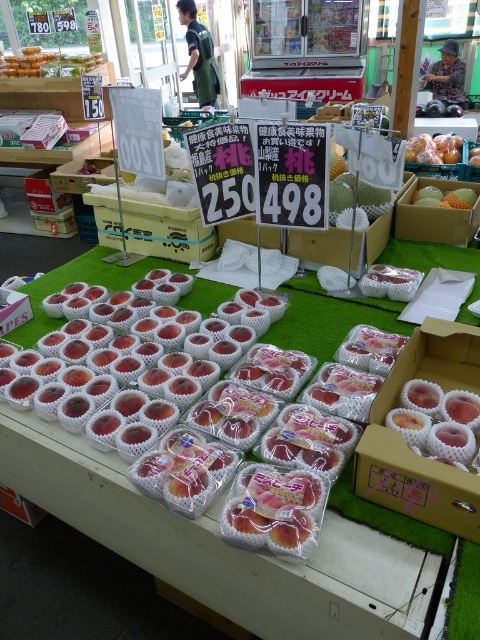
You are standing in front of the fruit display and want to pick up an item. The item you want is located at point (x=437, y=362). Another item you might consider is at point (x=456, y=192). Which item is closer to you?

The item at point (x=437, y=362) is closer to you than the item at point (x=456, y=192) because the former is closer to the camera.

You are a customer at the fruit market and want to locate two specific points of interest. The first point is at coordinate point (x=355, y=488) and the second is at point (x=437, y=115). From your position at the entrance, which point would you encounter first as you walk towards the back of the market?

Point (x=355, y=488) is in front of point (x=437, y=115), so you would encounter point (x=355, y=488) first as you walk towards the back of the market.

You are a customer at the fruit display and want to pick a peach. Which peach is on the left side between the translucent plastic peaches at center and the yellow matte peach at center?

The translucent plastic peaches at center is positioned on the left side of yellow matte peach at center.